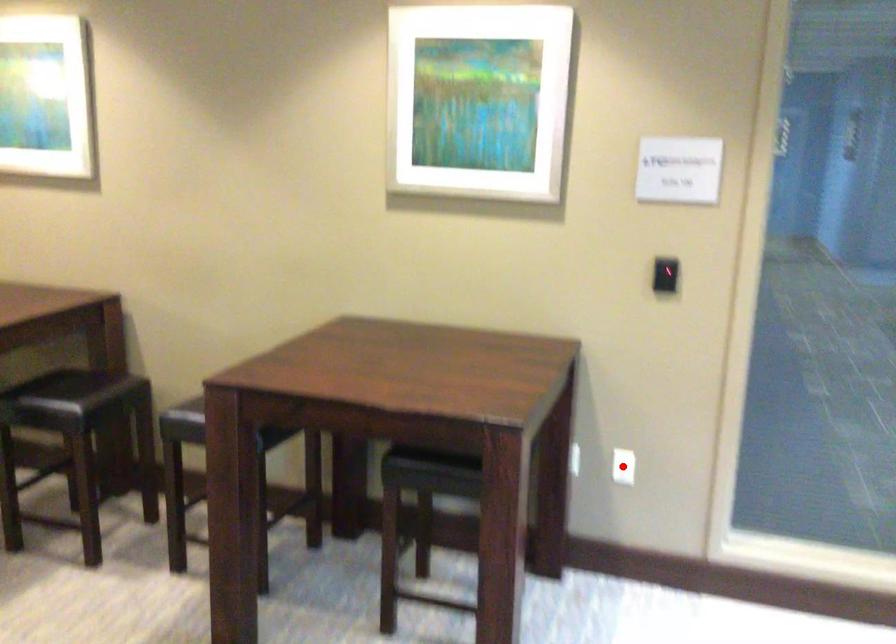
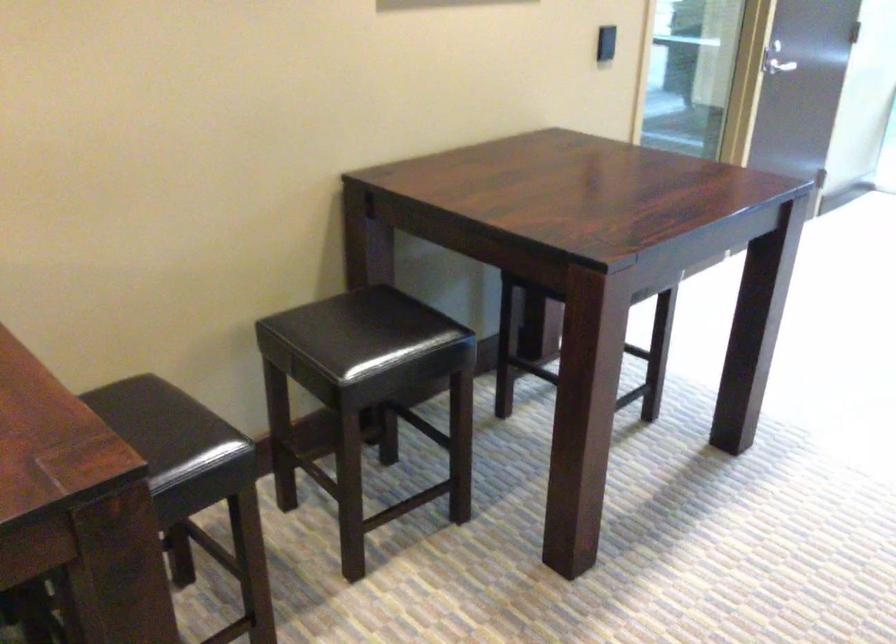
Question: I am providing you with two images of the same scene from different viewpoints. A red point is marked on the first image. Is the red point's position out of view in image 2?

Choices:
 (A) Yes
 (B) No

Answer: (A)